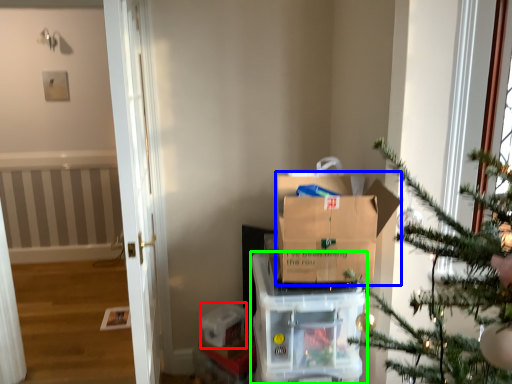
Question: Which is nearer to the storage box (highlighted by a red box)? cardboard box (highlighted by a blue box) or appliance (highlighted by a green box).

Choices:
 (A) cardboard box
 (B) appliance

Answer: (B)